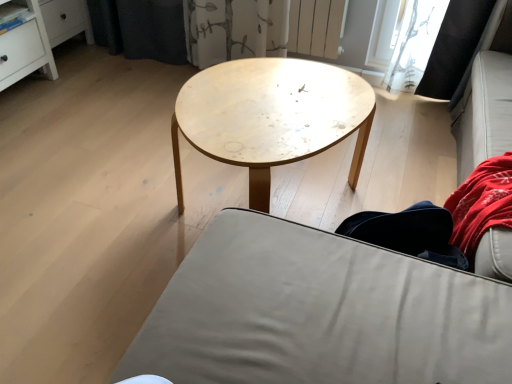
Question: Is denim pants at lower right inside or outside of natural wood coffee table at center?

Choices:
 (A) inside
 (B) outside

Answer: (B)

Question: From a real-world perspective, relative to natural wood coffee table at center, is denim pants at lower right vertically above or below?

Choices:
 (A) above
 (B) below

Answer: (A)

Question: Considering the real-world distances, which object is farthest from the natural wood coffee table at center?

Choices:
 (A) denim pants at lower right
 (B) matte gray fabric couch at center

Answer: (A)

Question: Estimate the real-world distances between objects in this image. Which object is farther from the denim pants at lower right?

Choices:
 (A) natural wood coffee table at center
 (B) matte gray fabric couch at center

Answer: (A)